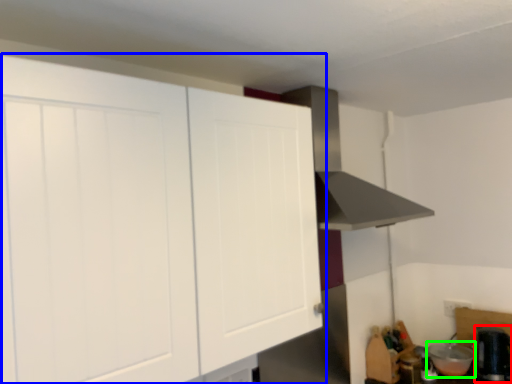
Question: Which object is the closest to the appliance (highlighted by a red box)? Choose among these: cabinetry (highlighted by a blue box) or appliance (highlighted by a green box).

Choices:
 (A) cabinetry
 (B) appliance

Answer: (B)